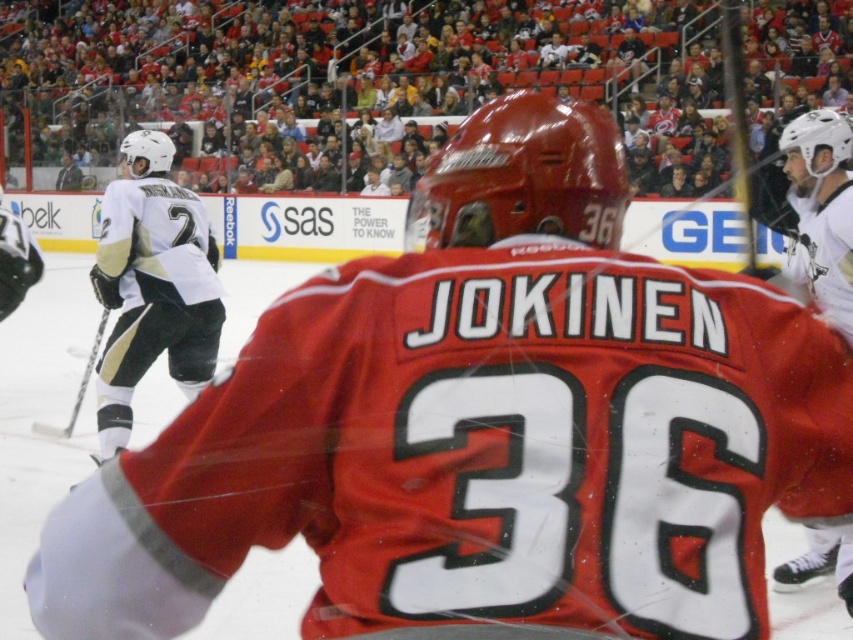
Question: Which object is positioned closest to the black metallic hockey stick at left?

Choices:
 (A) matte white helmet at upper right
 (B) white reebok jersey at left

Answer: (B)

Question: Does white reebok jersey at left have a greater width compared to matte white helmet at upper right?

Choices:
 (A) no
 (B) yes

Answer: (B)

Question: Which of the following is the farthest from the observer?

Choices:
 (A) black metallic hockey stick at left
 (B) matte white helmet at upper right

Answer: (A)

Question: Can you confirm if matte white helmet at upper right is wider than black metallic hockey stick at left?

Choices:
 (A) no
 (B) yes

Answer: (A)

Question: Which object is farther from the camera taking this photo?

Choices:
 (A) white reebok jersey at left
 (B) black metallic hockey stick at left

Answer: (B)

Question: Is matte white helmet at upper right above black metallic hockey stick at left?

Choices:
 (A) no
 (B) yes

Answer: (B)